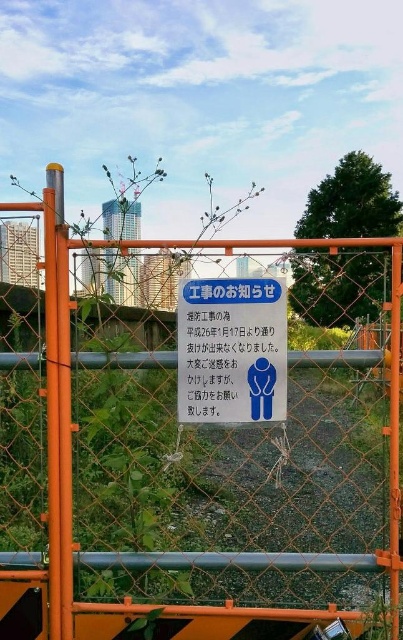
Who is taller, orange chain-link fence at center or blue paper at center?

With more height is orange chain-link fence at center.

Can you confirm if orange chain-link fence at center is bigger than blue paper at center?

Indeed, orange chain-link fence at center has a larger size compared to blue paper at center.

Locate an element on the screen. This screenshot has height=640, width=403. orange chain-link fence at center is located at coordinates (193, 456).